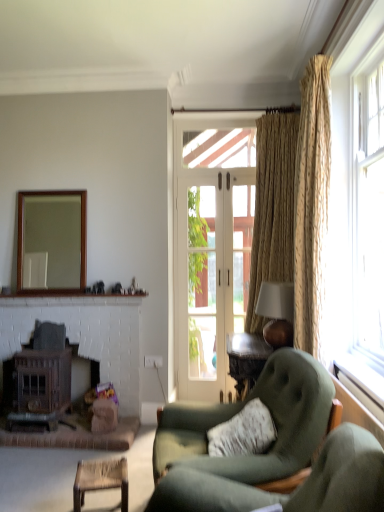
The image size is (384, 512). I want to click on free space above clear glass door at center (from a real-world perspective), so tap(207, 168).